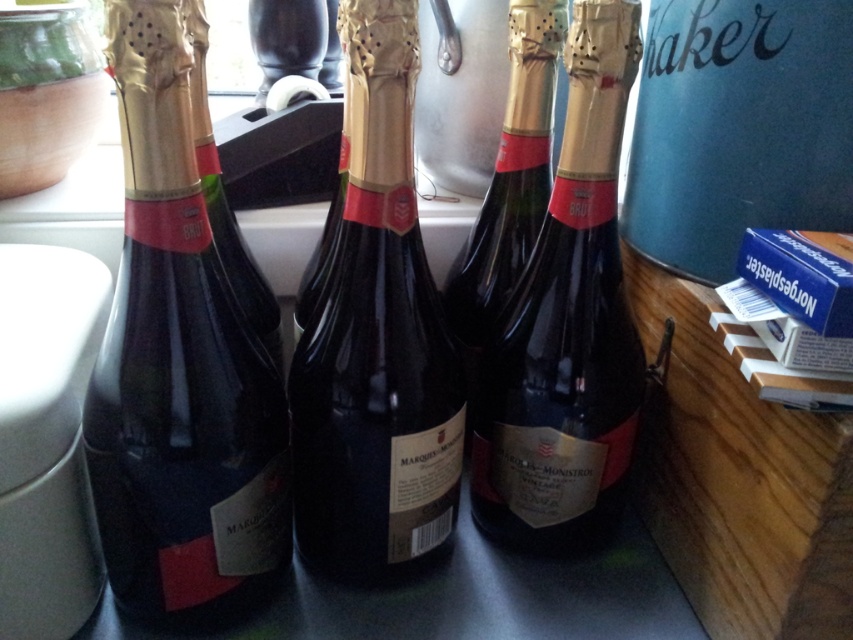
Question: Is matte black bottle at left to the right of dark glass bottle at center from the viewer's perspective?

Choices:
 (A) no
 (B) yes

Answer: (A)

Question: Is matte black bottle at left further to the viewer compared to matte gold foil champagne bottle at center?

Choices:
 (A) no
 (B) yes

Answer: (A)

Question: Among these points, which one is farthest from the camera?

Choices:
 (A) (538, 310)
 (B) (347, 248)

Answer: (A)

Question: Estimate the real-world distances between objects in this image. Which object is farther from the matte gold foil champagne bottle at center?

Choices:
 (A) matte black bottle at left
 (B) dark glass bottle at center

Answer: (B)

Question: Does matte black bottle at left have a larger size compared to matte gold foil champagne bottle at center?

Choices:
 (A) yes
 (B) no

Answer: (A)

Question: Based on their relative distances, which object is nearer to the matte gold foil champagne bottle at center?

Choices:
 (A) dark glass bottle at center
 (B) matte black bottle at left

Answer: (B)